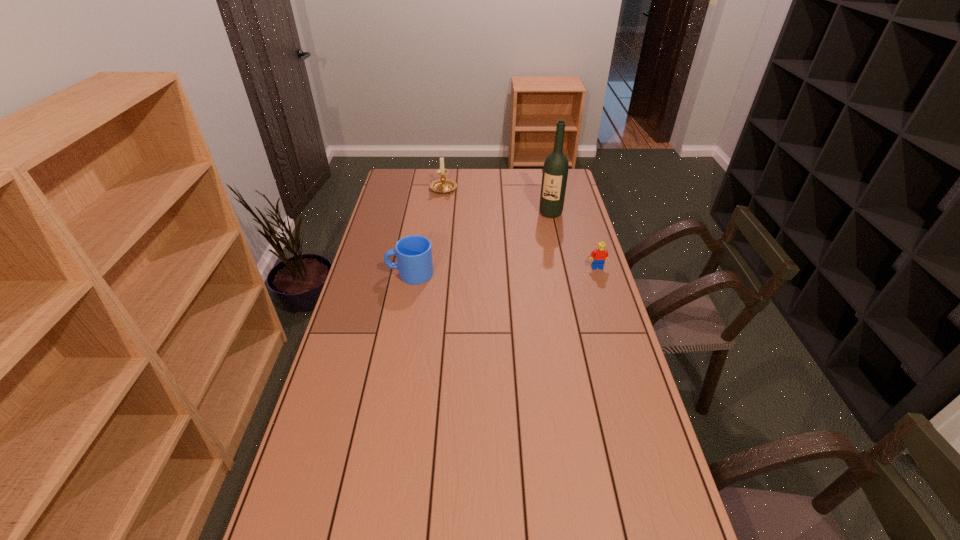
Identify the location of vacant point located with a handle on the side of the second tallest object. (493, 237).

Identify the location of free spot located 0.390m with a handle on the side of the second tallest object. The image size is (960, 540). (493, 237).

Find the location of `vacant space situated with a handle on the side of the second tallest object`. vacant space situated with a handle on the side of the second tallest object is located at coordinates (477, 221).

Find the location of a particular element. The width and height of the screenshot is (960, 540). free space located on the labeled side of the third object from left to right is located at coordinates (537, 245).

Locate an element on the screen. The width and height of the screenshot is (960, 540). free spot located 0.340m on the labeled side of the third object from left to right is located at coordinates (527, 265).

Where is `vacant space located on the labeled side of the third object from left to right`? vacant space located on the labeled side of the third object from left to right is located at coordinates (527, 265).

At what (x,y) coordinates should I click in order to perform the action: click on object located at the far edge. Please return your answer as a coordinate pair (x, y). Image resolution: width=960 pixels, height=540 pixels. Looking at the image, I should click on (442, 185).

Find the location of a particular element. This screenshot has width=960, height=540. object located at the left edge is located at coordinates (414, 257).

The image size is (960, 540). In order to click on Lego that is at the right edge in this screenshot , I will do `click(599, 255)`.

Where is `wine bottle situated at the right edge`? This screenshot has width=960, height=540. wine bottle situated at the right edge is located at coordinates (555, 170).